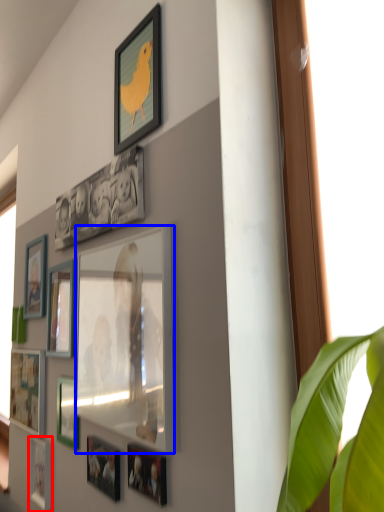
Question: Which of the following is the closest to the observer, picture frame (highlighted by a red box) or picture frame (highlighted by a blue box)?

Choices:
 (A) picture frame
 (B) picture frame

Answer: (B)